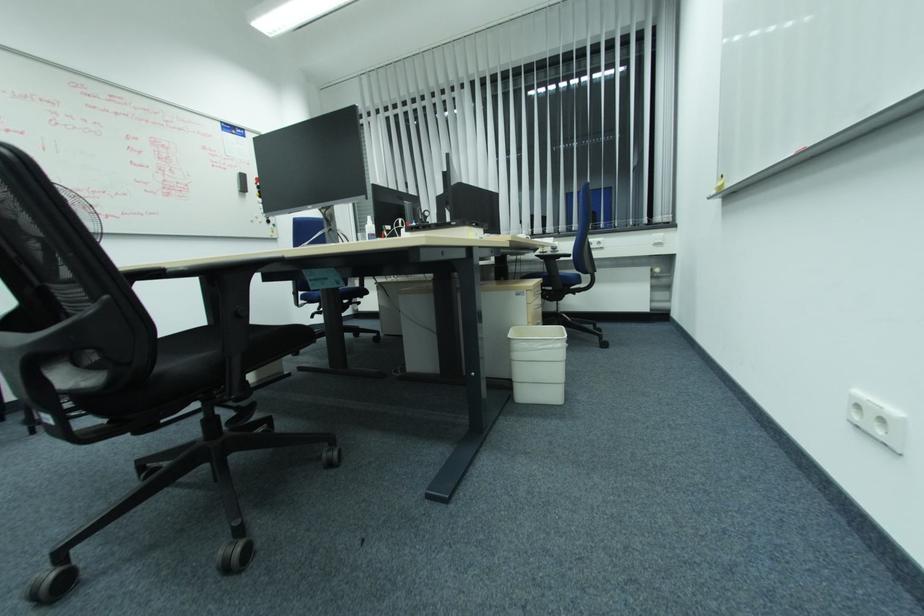
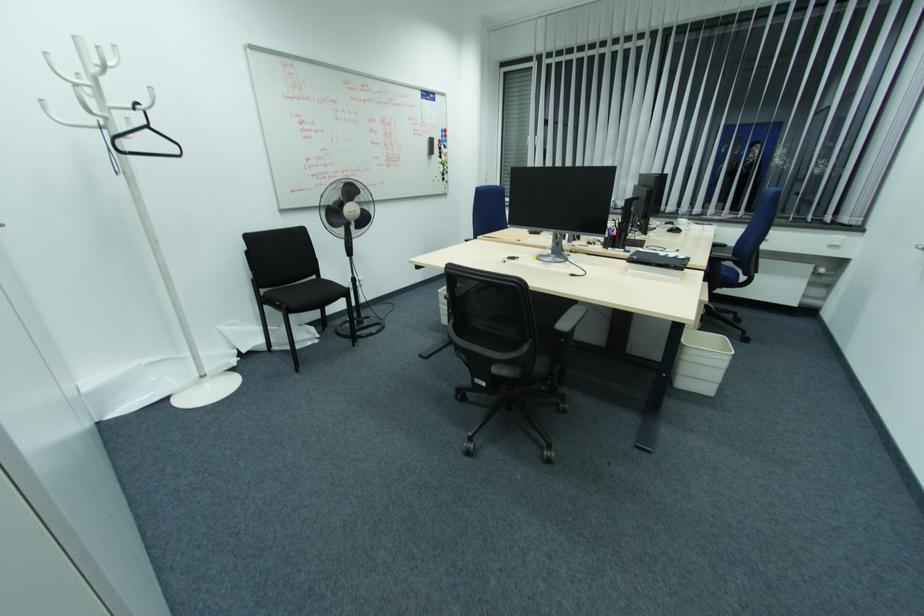
Find the pixel in the second image that matches (526,345) in the first image.

(698, 353)